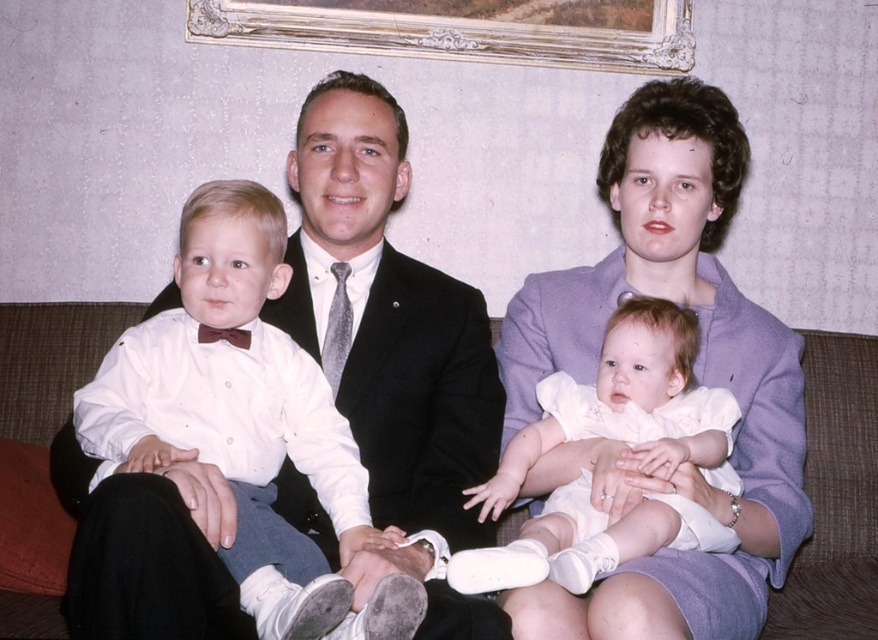
Does point (393, 392) lie behind point (682, 368)?

Yes.

Who is positioned more to the left, matte black suit at center or white satin dress at center?

From the viewer's perspective, matte black suit at center appears more on the left side.

The height and width of the screenshot is (640, 878). Describe the element at coordinates (387, 317) in the screenshot. I see `matte black suit at center` at that location.

Identify the location of matte black suit at center. The image size is (878, 640). (387, 317).

Who is more forward, (x=685, y=216) or (x=714, y=410)?

Point (x=714, y=410) is in front.

Where is `purple fabric dress at center`? purple fabric dress at center is located at coordinates (694, 376).

Does point (759, 548) come closer to viewer compared to point (833, 506)?

Yes.

Who is positioned more to the right, purple fabric dress at center or brown fabric couch at center?

From the viewer's perspective, purple fabric dress at center appears more on the right side.

Image resolution: width=878 pixels, height=640 pixels. I want to click on purple fabric dress at center, so click(694, 376).

What are the coordinates of `purple fabric dress at center` in the screenshot? It's located at (694, 376).